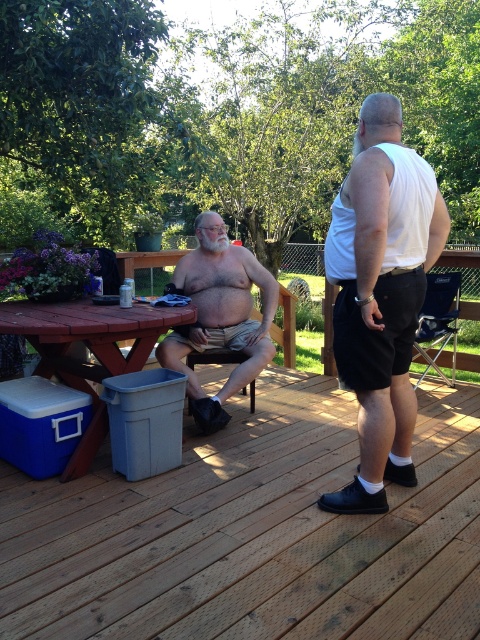
Question: Estimate the real-world distances between objects in this image. Which object is farther from the white matte tank top at center?

Choices:
 (A) wooden deck at center
 (B) wooden picnic table at lower left

Answer: (B)

Question: Does wooden deck at center appear over beige cotton shorts at center?

Choices:
 (A) yes
 (B) no

Answer: (B)

Question: Is beige cotton shorts at center positioned behind wooden picnic table at lower left?

Choices:
 (A) no
 (B) yes

Answer: (B)

Question: Does wooden deck at center appear under white matte tank top at center?

Choices:
 (A) no
 (B) yes

Answer: (B)

Question: Which of the following is the farthest from the observer?

Choices:
 (A) white matte tank top at center
 (B) wooden deck at center
 (C) beige cotton shorts at center

Answer: (C)

Question: Which of the following is the closest to the observer?

Choices:
 (A) wooden picnic table at lower left
 (B) beige cotton shorts at center
 (C) white matte tank top at center
 (D) wooden deck at center

Answer: (D)